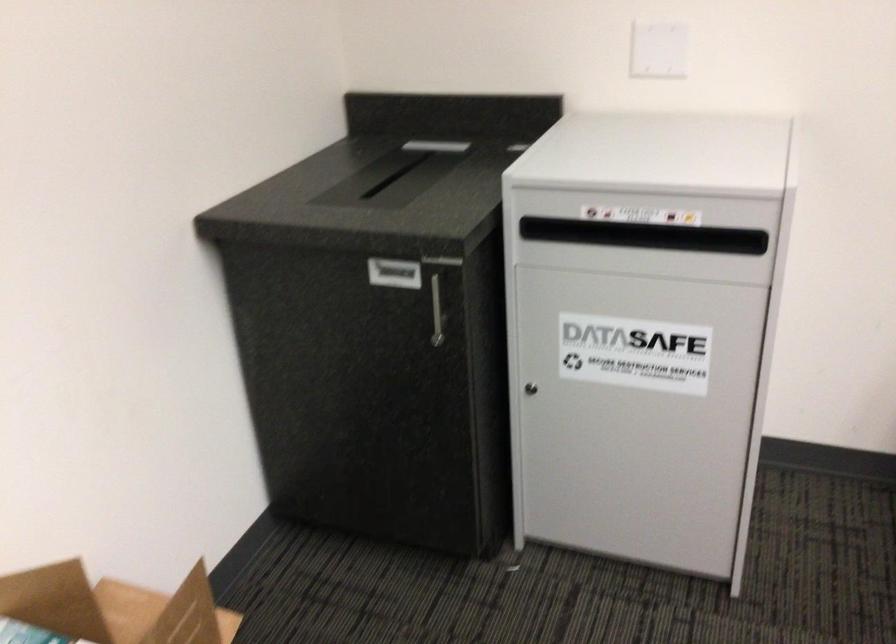
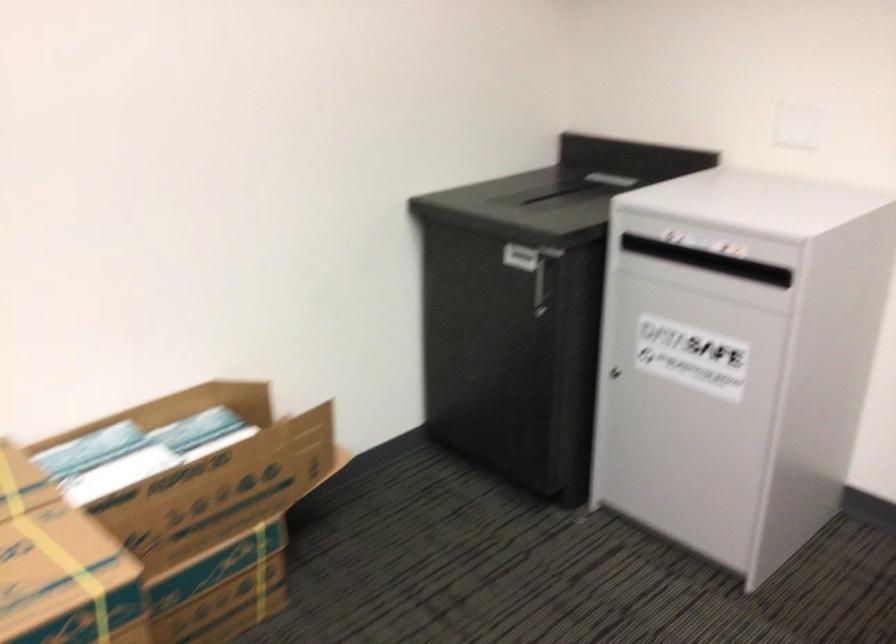
Question: I am providing you with two images of the same scene from different viewpoints. After the viewpoint changes to image2, which objects are now occluded?

Choices:
 (A) rolled pink mat
 (B) grey safe slot
 (C) safe keyhole
 (D) black bin slot

Answer: (D)